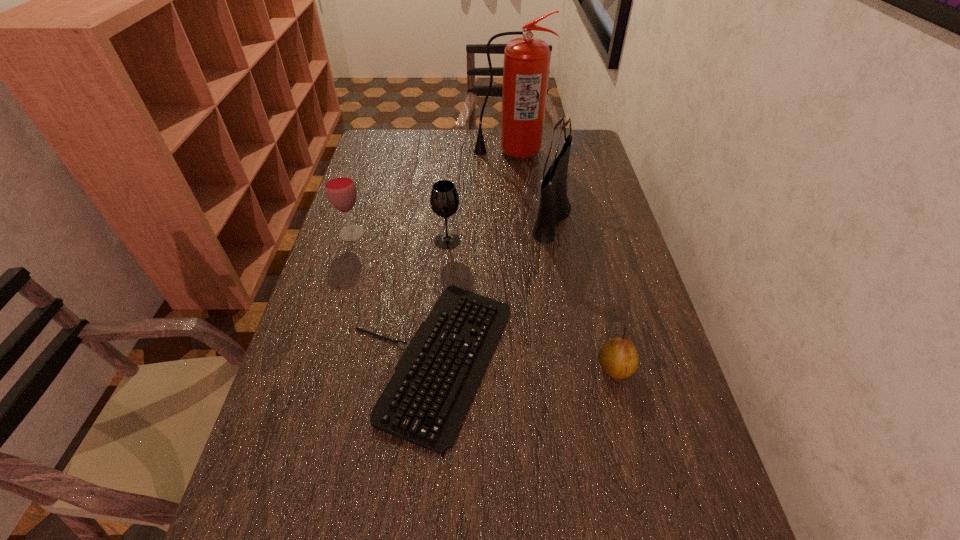
This screenshot has height=540, width=960. What are the coordinates of `the tallest object` in the screenshot? It's located at (526, 65).

Where is `fire extinguisher`? This screenshot has height=540, width=960. fire extinguisher is located at coordinates (526, 65).

Identify the location of shoulder bag. (554, 207).

You are a GUI agent. You are given a task and a screenshot of the screen. Output one action in this format:
    pyautogui.click(x=<x>, y=<y>)
    Task: Click on the right wineglass
    The height and width of the screenshot is (540, 960).
    Given the screenshot: What is the action you would take?
    pyautogui.click(x=444, y=200)

Where is `the left wineglass`? The image size is (960, 540). the left wineglass is located at coordinates (340, 189).

Locate an element on the screen. pear is located at coordinates (618, 357).

Locate an element on the screen. computer keyboard is located at coordinates (425, 402).

Where is `free region located 0.090m on the instruction side of the tallest object`? free region located 0.090m on the instruction side of the tallest object is located at coordinates (513, 176).

Identify the location of blank space located on the right of the shoulder bag. (608, 217).

Where is `free spot located 0.400m on the right of the right wineglass`? Image resolution: width=960 pixels, height=540 pixels. free spot located 0.400m on the right of the right wineglass is located at coordinates (593, 241).